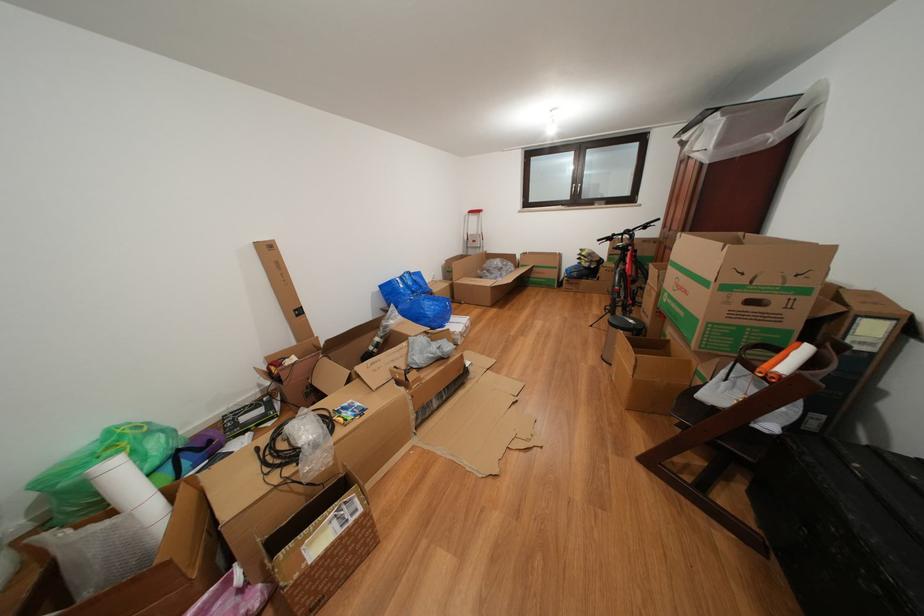
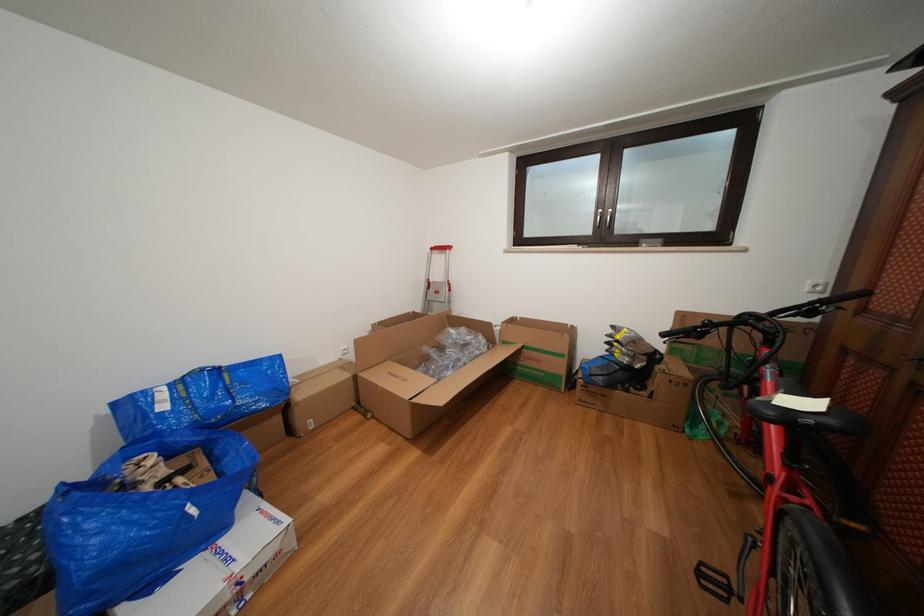
In the second image, find the point that corresponds to the point at 580,188 in the first image.

(605, 214)